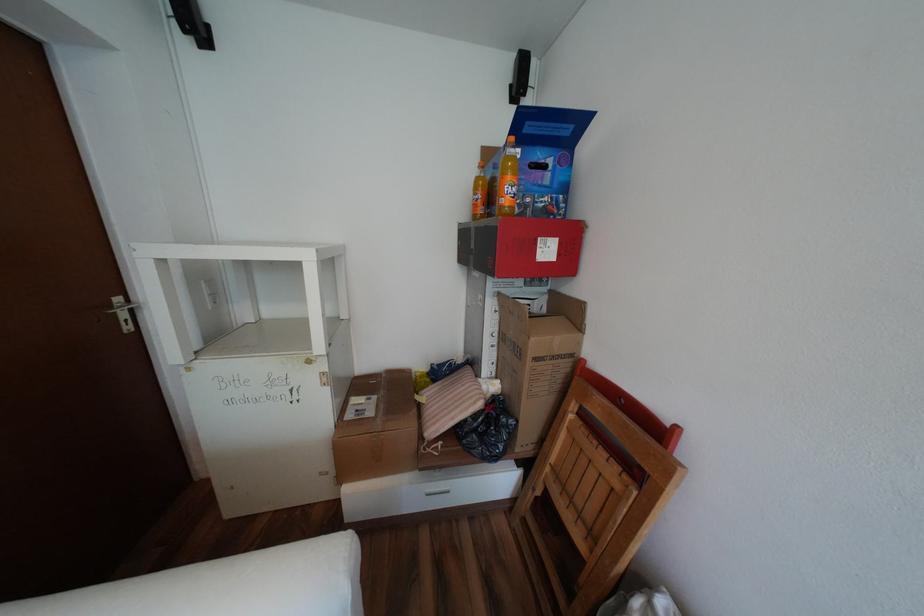
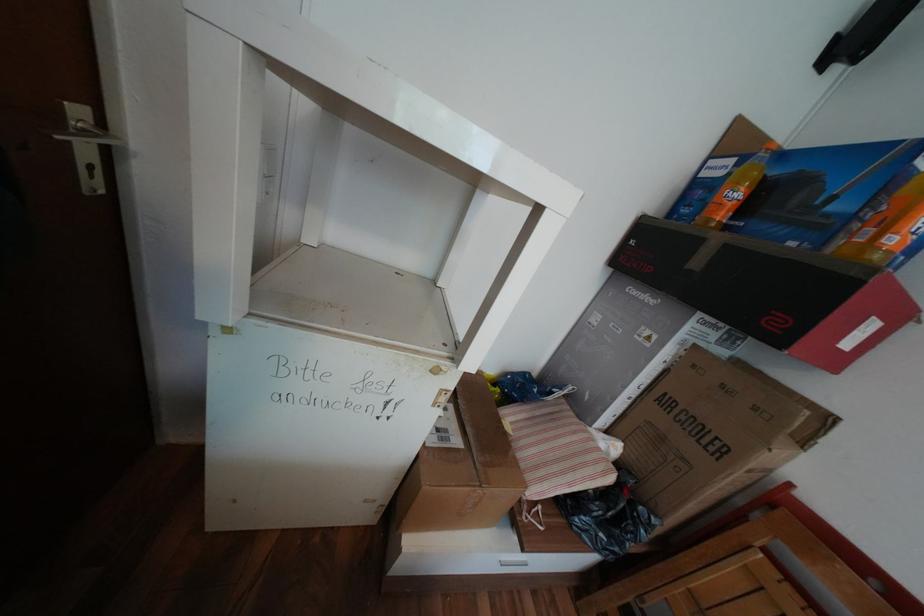
Question: The images are taken continuously from a first-person perspective. In which direction is your viewpoint rotating?

Choices:
 (A) Left
 (B) Right
 (C) Up
 (D) Down

Answer: (D)